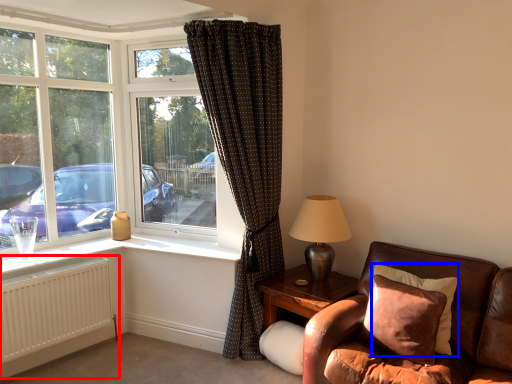
Question: Which point is further to the camera, radiator (highlighted by a red box) or pillow (highlighted by a blue box)?

Choices:
 (A) radiator
 (B) pillow

Answer: (A)